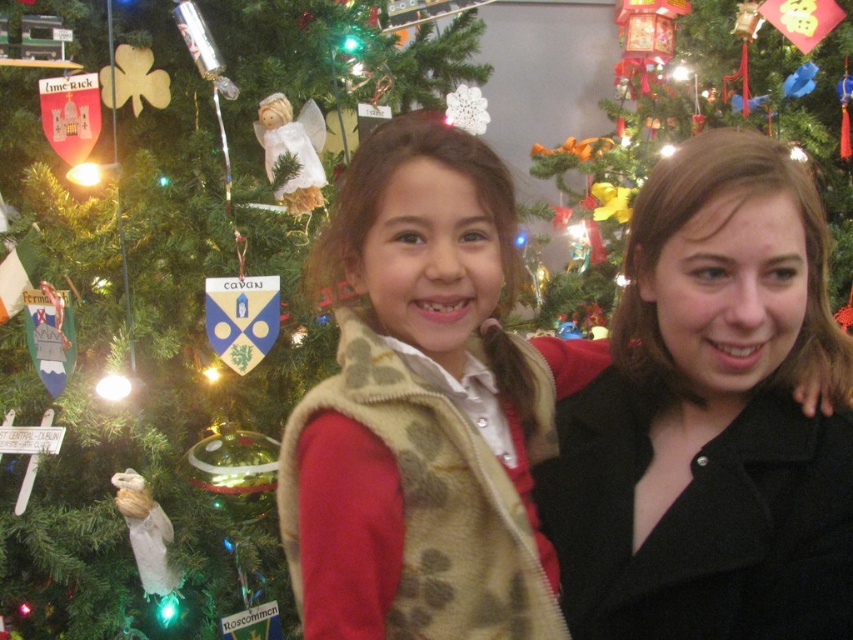
Is green matte christmas tree at left to the left of beige textured vest at center from the viewer's perspective?

Indeed, green matte christmas tree at left is positioned on the left side of beige textured vest at center.

Looking at this image, which of these two, green matte christmas tree at left or beige textured vest at center, stands shorter?

With less height is beige textured vest at center.

Who is more forward, (x=12, y=378) or (x=416, y=516)?

Point (x=416, y=516) is more forward.

You are a GUI agent. You are given a task and a screenshot of the screen. Output one action in this format:
    pyautogui.click(x=<x>, y=<y>)
    Task: Click on the green matte christmas tree at left
    The image size is (853, 640).
    Given the screenshot: What is the action you would take?
    pyautogui.click(x=236, y=209)

Who is positioned more to the left, black matte coat at center or beige textured vest at center?

From the viewer's perspective, beige textured vest at center appears more on the left side.

Between black matte coat at center and beige textured vest at center, which one is positioned higher?

beige textured vest at center is above.

Identify the location of black matte coat at center. This screenshot has height=640, width=853. (711, 419).

Does black matte coat at center have a greater width compared to green matte christmas tree at left?

Incorrect, black matte coat at center's width does not surpass green matte christmas tree at left's.

Can you confirm if black matte coat at center is smaller than green matte christmas tree at left?

Correct, black matte coat at center occupies less space than green matte christmas tree at left.

Is point (781, 198) more distant than point (392, 38)?

No.

Find the location of `black matte coat at center`. black matte coat at center is located at coordinates (711, 419).